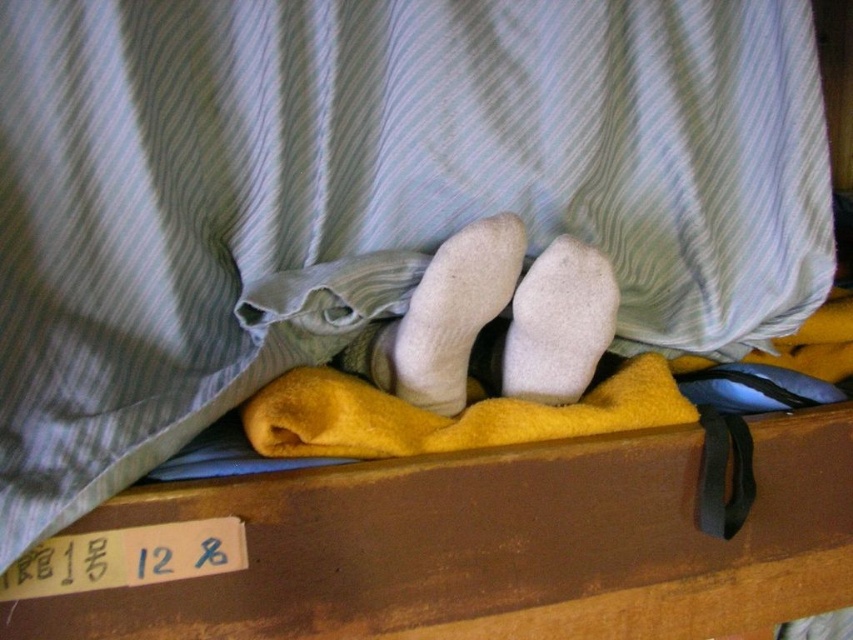
You have a small toy car that is 5 inches long. You want to move it from the brown wooden drawer at lower center to the white fuzzy sock at center. Can the toy car fit in the space between them?

The brown wooden drawer at lower center and white fuzzy sock at center are 6.47 inches apart from each other. Since the toy car is 5 inches long, it can fit in the space between them because 5 inches is less than 6.47 inches.

You are organizing your bedroom and want to place a new decorative item between the brown wooden drawer at lower center and the white fuzzy sock at center. Based on their positions, which object should you place the item closer to in order for it to be closer to you?

The brown wooden drawer at lower center is closer to the viewer than the white fuzzy sock at center, so placing the decorative item closer to the brown wooden drawer at lower center will make it nearer to you.